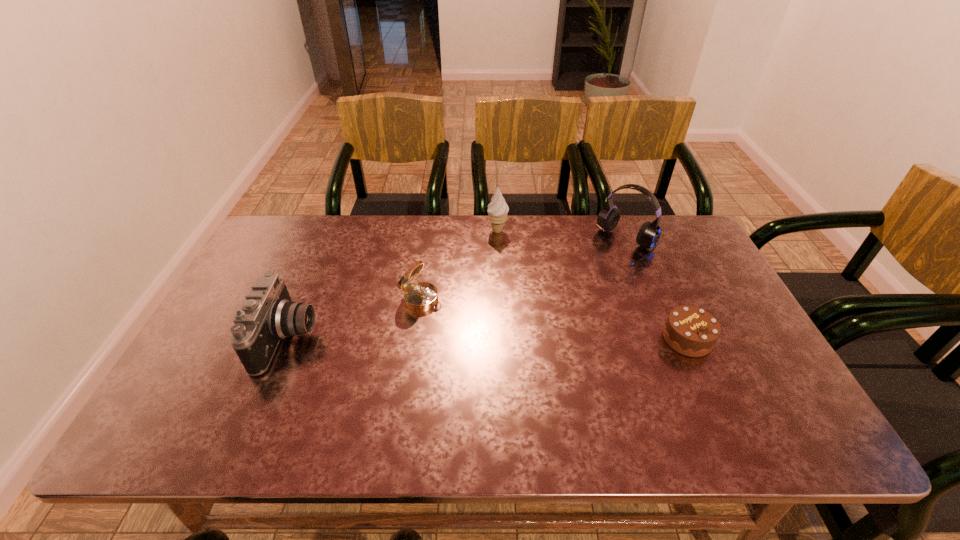
Locate an element on the screen. The width and height of the screenshot is (960, 540). vacant area at the near left corner of the desktop is located at coordinates (180, 399).

I want to click on free space between the third object from left to right and the leftmost object, so click(x=393, y=285).

The image size is (960, 540). What are the coordinates of `free space that is in between the fourth tallest object and the headset` in the screenshot? It's located at (525, 272).

Locate an element on the screen. The height and width of the screenshot is (540, 960). free space between the headset and the camera is located at coordinates (459, 292).

You are a GUI agent. You are given a task and a screenshot of the screen. Output one action in this format:
    pyautogui.click(x=<x>, y=<y>)
    Task: Click on the free point between the headset and the camera
    The height and width of the screenshot is (540, 960).
    Given the screenshot: What is the action you would take?
    pyautogui.click(x=459, y=292)

Identify the location of vacant area that lies between the camera and the headset. (459, 292).

You are a GUI agent. You are given a task and a screenshot of the screen. Output one action in this format:
    pyautogui.click(x=<x>, y=<y>)
    Task: Click on the free space that is in between the chocolate cake and the headset
    The image size is (960, 540).
    Given the screenshot: What is the action you would take?
    pyautogui.click(x=658, y=293)

Locate an element on the screen. free space between the second object from left to right and the chocolate cake is located at coordinates (554, 318).

I want to click on unoccupied area between the shortest object and the camera, so click(488, 339).

Identify the location of blank region between the shortest object and the icecream. (592, 285).